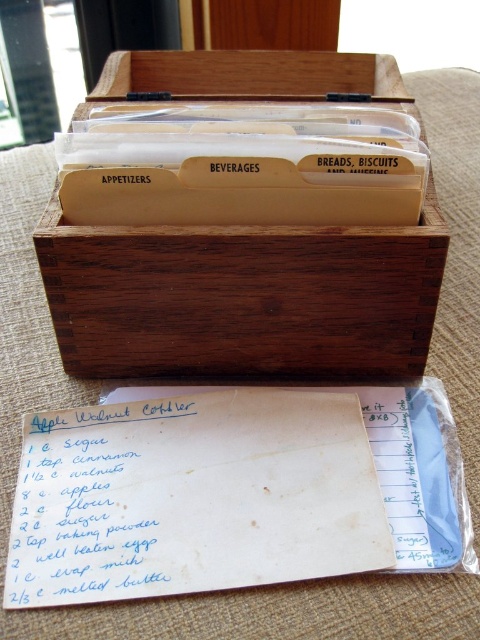
The height and width of the screenshot is (640, 480). What do you see at coordinates (242, 298) in the screenshot?
I see `wooden box at center` at bounding box center [242, 298].

The height and width of the screenshot is (640, 480). Describe the element at coordinates (242, 298) in the screenshot. I see `wooden box at center` at that location.

Identify the location of wooden box at center. The width and height of the screenshot is (480, 640). (242, 298).